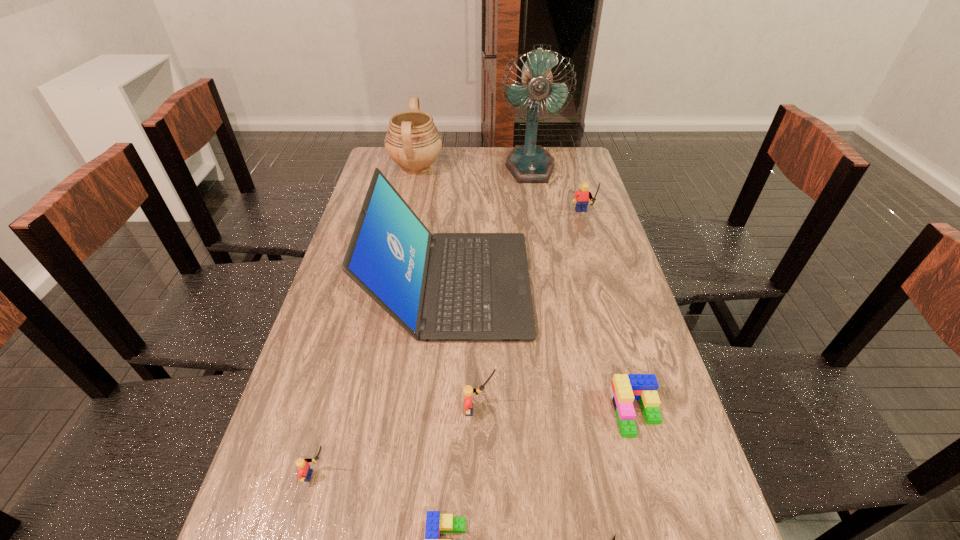
Where is `the second nearest Lego`? the second nearest Lego is located at coordinates (x=304, y=473).

The height and width of the screenshot is (540, 960). I want to click on the right green Lego, so click(x=625, y=388).

Where is `the bigger green Lego`? This screenshot has width=960, height=540. the bigger green Lego is located at coordinates coord(625,388).

The image size is (960, 540). I want to click on vacant space located in front of the blue fan where the wind blows, so click(537, 204).

This screenshot has height=540, width=960. Find the location of `free space located 0.280m on the screen of the laptop computer`. free space located 0.280m on the screen of the laptop computer is located at coordinates [627, 284].

This screenshot has height=540, width=960. Identify the location of free location located 0.350m on the front-facing side of the urn. (532, 167).

Locate an element on the screen. This screenshot has width=960, height=540. vacant space located 0.160m on the front-facing side of the rightmost yellow Lego is located at coordinates tap(593, 253).

Locate an element on the screen. This screenshot has height=540, width=960. free space located 0.170m on the front-facing side of the second biggest yellow Lego is located at coordinates click(572, 410).

Locate an element on the screen. The image size is (960, 540). blank space located on the front-facing side of the leftmost yellow Lego is located at coordinates pos(519,475).

What are the coordinates of `free location located 0.120m on the front of the fourth tallest Lego` in the screenshot? It's located at (660, 498).